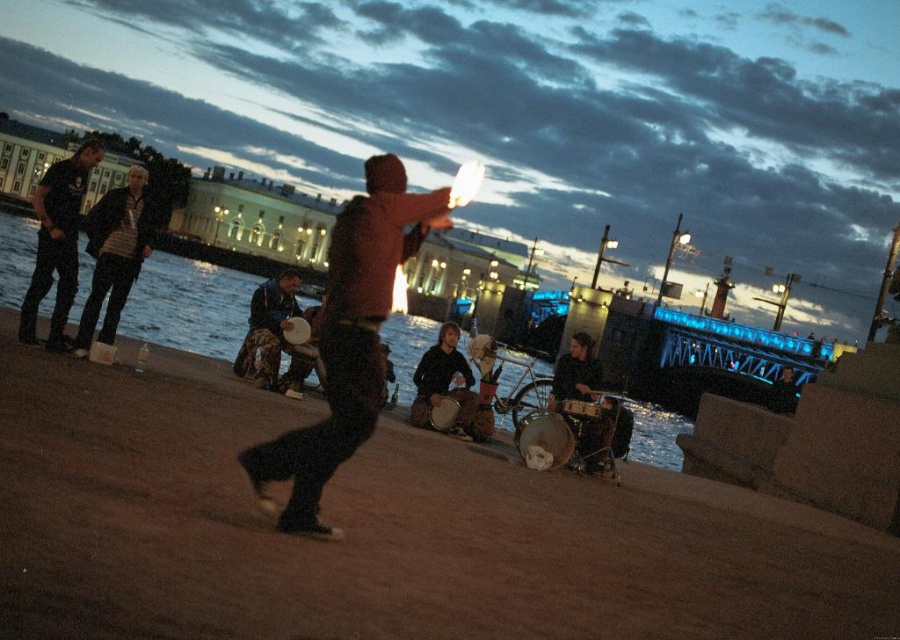
Question: Among these objects, which one is farthest from the camera?

Choices:
 (A) brown sand at center
 (B) camouflage fabric drum at center
 (C) matte black jacket at left
 (D) smooth wooden drum at lower center

Answer: (B)

Question: Is dark brown leather jacket at center below smooth wooden drum at lower center?

Choices:
 (A) no
 (B) yes

Answer: (A)

Question: Which object is positioned closest to the dark brown leather jacket at center?

Choices:
 (A) camouflage fabric drum at center
 (B) blue water at lower center
 (C) matte black jacket at left
 (D) smooth wooden drum at lower center

Answer: (D)

Question: Does dark jeans at left lie behind brown leather drum at center?

Choices:
 (A) yes
 (B) no

Answer: (B)

Question: Based on their relative distances, which object is nearer to the blue water at lower center?

Choices:
 (A) brown leather drum at center
 (B) smooth wooden drum at lower center
 (C) matte black jacket at left

Answer: (A)

Question: Is blue water at lower center smaller than camouflage fabric drum at center?

Choices:
 (A) yes
 (B) no

Answer: (B)